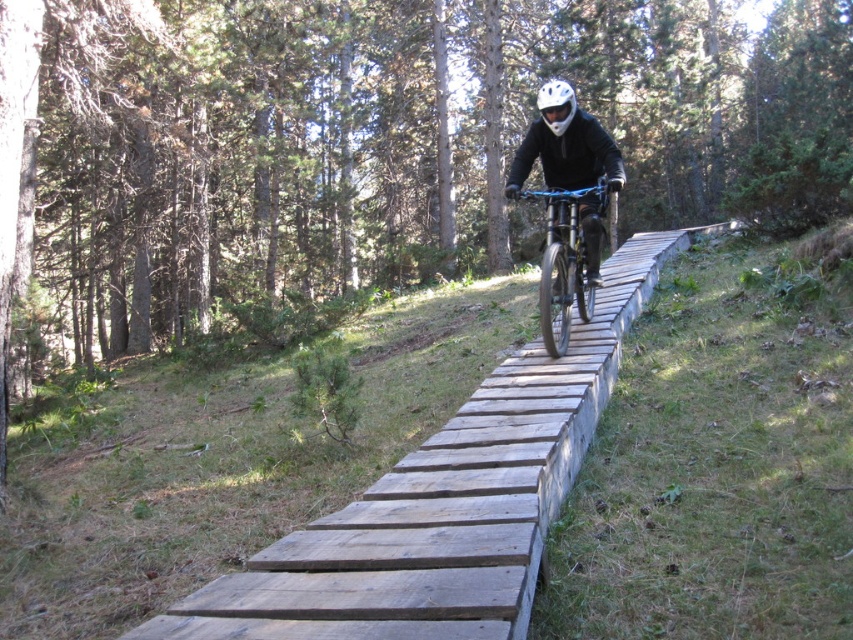
Question: Which of the following is the farthest from the observer?

Choices:
 (A) shiny black bike at center
 (B) matte black helmet at center
 (C) white matte helmet at center

Answer: (C)

Question: Is matte black helmet at center positioned at the back of shiny black bike at center?

Choices:
 (A) yes
 (B) no

Answer: (A)

Question: Estimate the real-world distances between objects in this image. Which object is farther from the matte black helmet at center?

Choices:
 (A) white matte helmet at center
 (B) shiny black bike at center

Answer: (A)

Question: Is matte black helmet at center positioned before shiny black bike at center?

Choices:
 (A) no
 (B) yes

Answer: (A)

Question: Which point appears closest to the camera in this image?

Choices:
 (A) (566, 124)
 (B) (561, 204)
 (C) (590, 140)

Answer: (A)

Question: Does matte black helmet at center appear on the right side of shiny black bike at center?

Choices:
 (A) yes
 (B) no

Answer: (B)